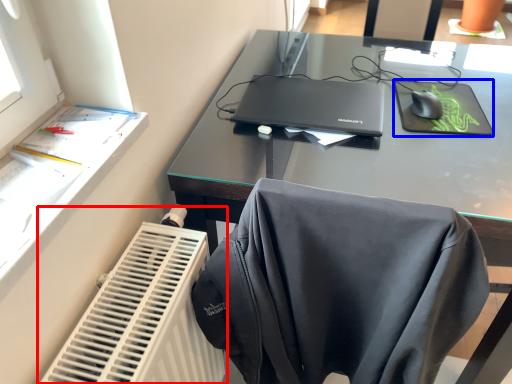
Question: Which object is closer to the camera taking this photo, radiator (highlighted by a red box) or mousepad (highlighted by a blue box)?

Choices:
 (A) radiator
 (B) mousepad

Answer: (A)